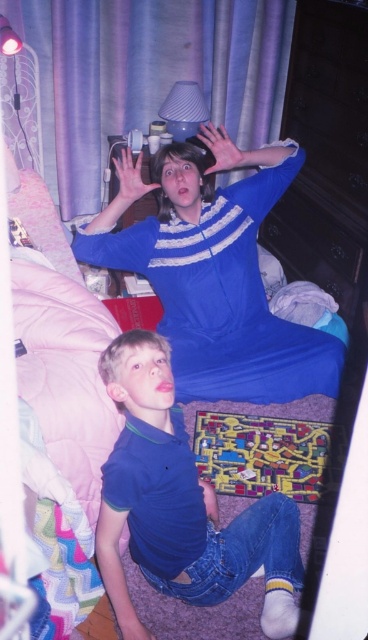
Between blue smooth dress at upper center and matte plastic lampshade at upper center, which one is positioned higher?

matte plastic lampshade at upper center is above.

Which of these two, blue smooth dress at upper center or matte plastic lampshade at upper center, stands shorter?

matte plastic lampshade at upper center

Which is behind, point (236, 250) or point (179, 131)?

Point (179, 131)

Where is `blue smooth dress at upper center`? blue smooth dress at upper center is located at coordinates (214, 273).

Between purple fabric curtain at upper center and matte plastic lampshade at upper center, which one is positioned lower?

matte plastic lampshade at upper center

Who is more forward, (x=66, y=96) or (x=189, y=118)?

Positioned in front is point (x=189, y=118).

Where is `purple fabric curtain at upper center`? Image resolution: width=368 pixels, height=640 pixels. purple fabric curtain at upper center is located at coordinates (146, 74).

Which is more to the right, blue smooth dress at upper center or blue cotton shirt at lower left?

blue smooth dress at upper center is more to the right.

From the picture: Between blue smooth dress at upper center and blue cotton shirt at lower left, which one is positioned lower?

blue cotton shirt at lower left is below.

This screenshot has width=368, height=640. What do you see at coordinates (214, 273) in the screenshot?
I see `blue smooth dress at upper center` at bounding box center [214, 273].

You are a GUI agent. You are given a task and a screenshot of the screen. Output one action in this format:
    pyautogui.click(x=<x>, y=<y>)
    Task: Click on the blue smooth dress at upper center
    The image size is (368, 640).
    Given the screenshot: What is the action you would take?
    pyautogui.click(x=214, y=273)